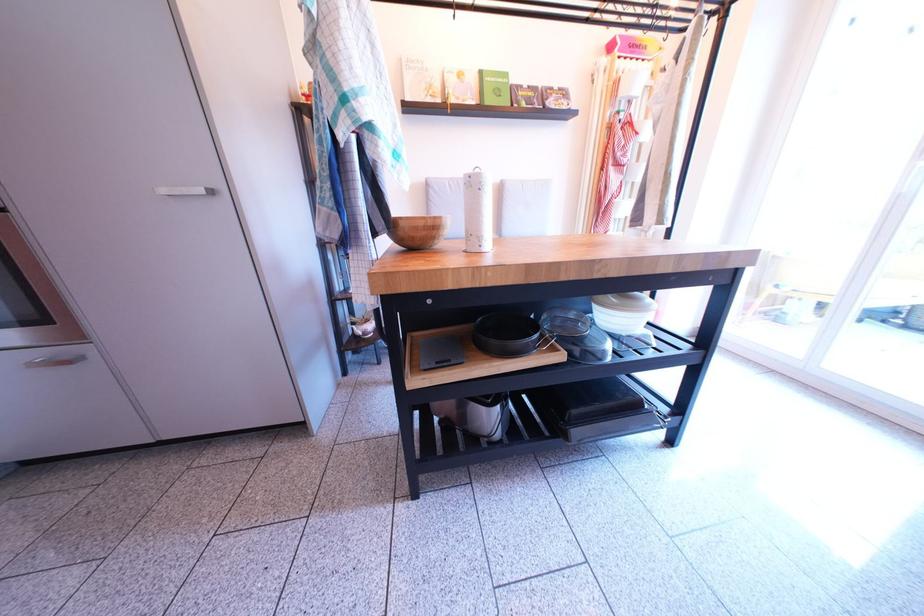
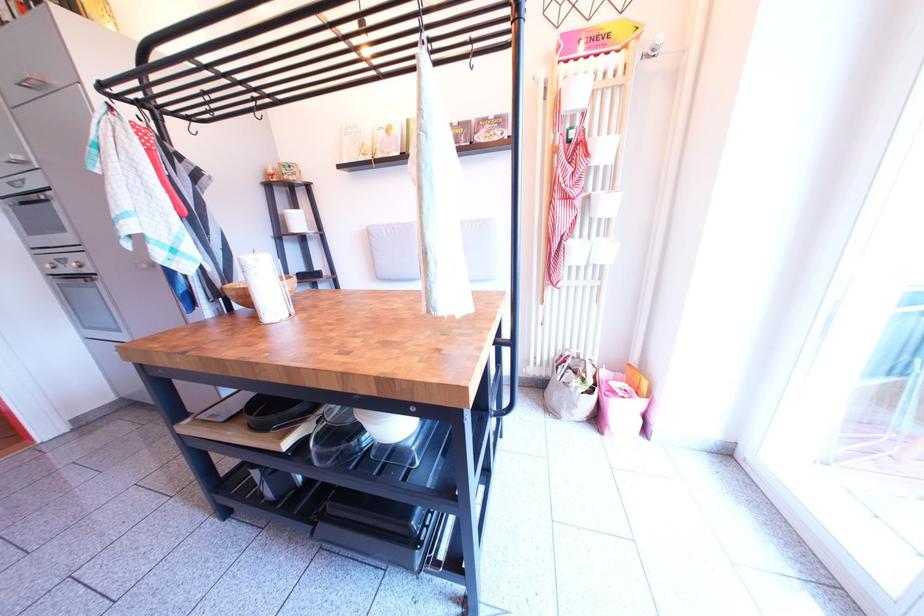
Find the pixel in the second image that matches pixel 448 92 in the first image.

(380, 150)